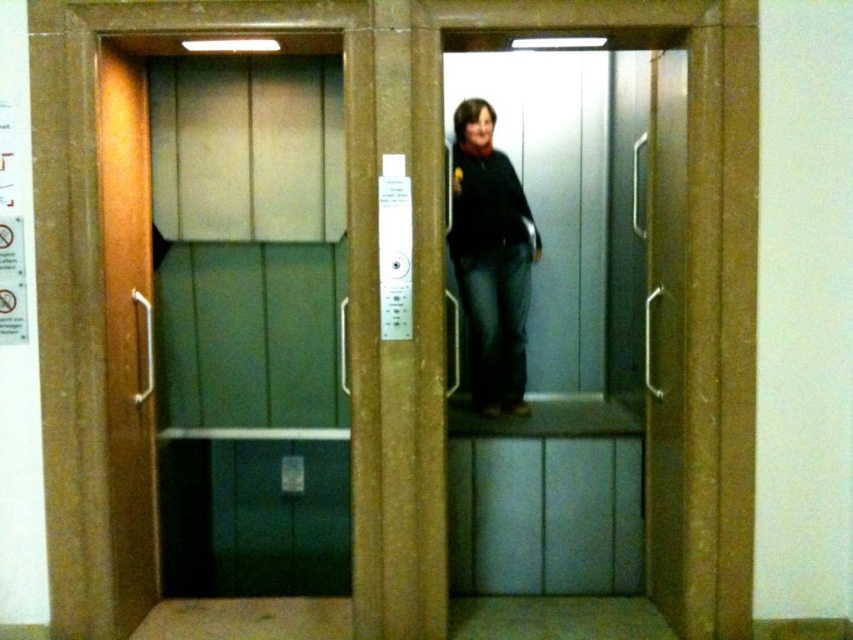
Does point (135, 364) come in front of point (474, 122)?

Yes, it is in front of point (474, 122).

Is wooden door at left thinner than matte black sweater at center?

Yes.

Between point (115, 214) and point (462, 275), which one is positioned behind?

Point (462, 275)

Find the location of `wooden door at left`. wooden door at left is located at coordinates (126, 332).

Can you confirm if wooden elevator door at center is thinner than matte black sweater at center?

Indeed, wooden elevator door at center has a lesser width compared to matte black sweater at center.

Is point (647, 349) positioned before point (451, 218)?

No, it is not.

Who is more forward, (666, 429) or (488, 369)?

Point (666, 429) is in front.

The image size is (853, 640). In order to click on wooden elevator door at center in this screenshot , I will do `click(665, 332)`.

Which is behind, point (115, 97) or point (677, 216)?

Positioned behind is point (115, 97).

Does wooden door at left have a smaller size compared to wooden elevator door at center?

Incorrect, wooden door at left is not smaller in size than wooden elevator door at center.

Measure the distance between point (131,525) and camera.

Point (131,525) is 9.70 feet from camera.

The width and height of the screenshot is (853, 640). I want to click on wooden door at left, so click(x=126, y=332).